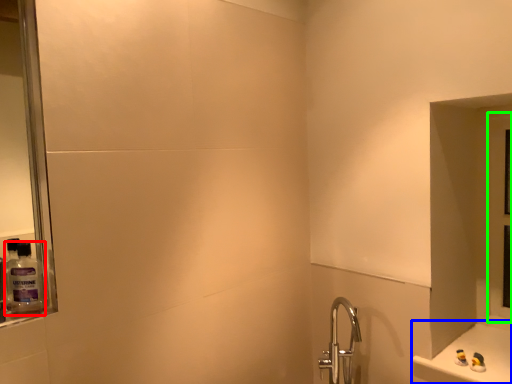
Question: Which object is positioned farthest from mouthwash (highlighted by a red box)? Select from counter (highlighted by a blue box) and glass door (highlighted by a green box).

Choices:
 (A) counter
 (B) glass door

Answer: (B)